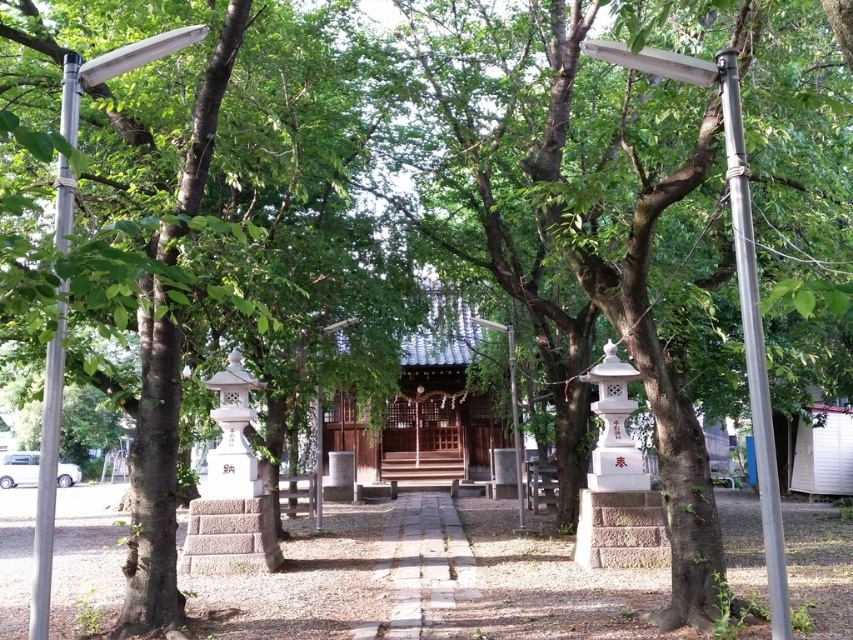
You are a visitor at the shrine and want to place a small offering between the metallic silver pole at left and the metallic pole at center. The offering requires a space of 7 meters. Will there be enough space between them?

The metallic silver pole at left is 7.60 meters from metallic pole at center. Since the required space is 7 meters, there is enough space between them for the offering.

You are a visitor at the shrine and want to place a small offering between the metallic pole at right and the silver metallic pole at left. The offering requires a space of 3 meters. Can you fit it there?

The metallic pole at right is 3.21 meters away from the silver metallic pole at left, so yes, the offering can fit as the distance is slightly more than required.